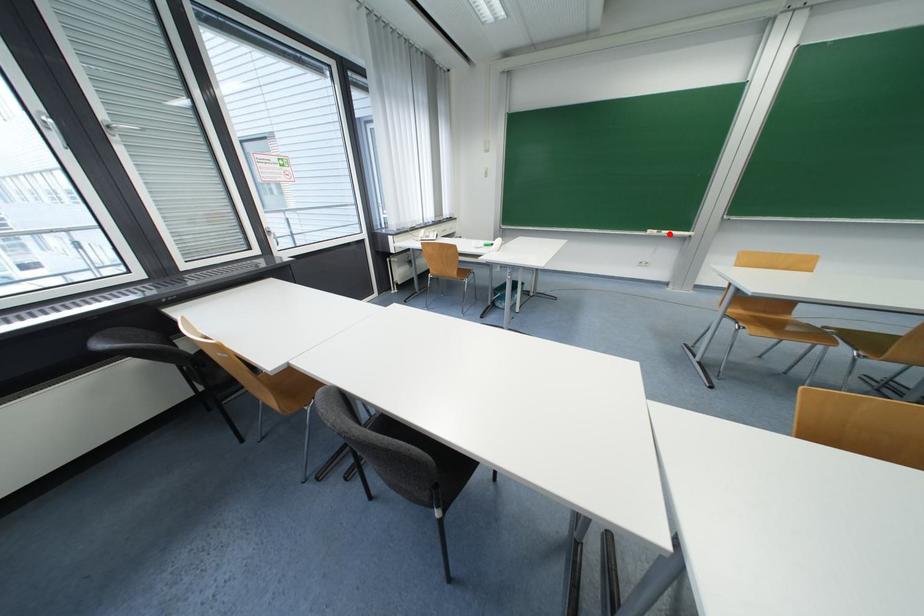
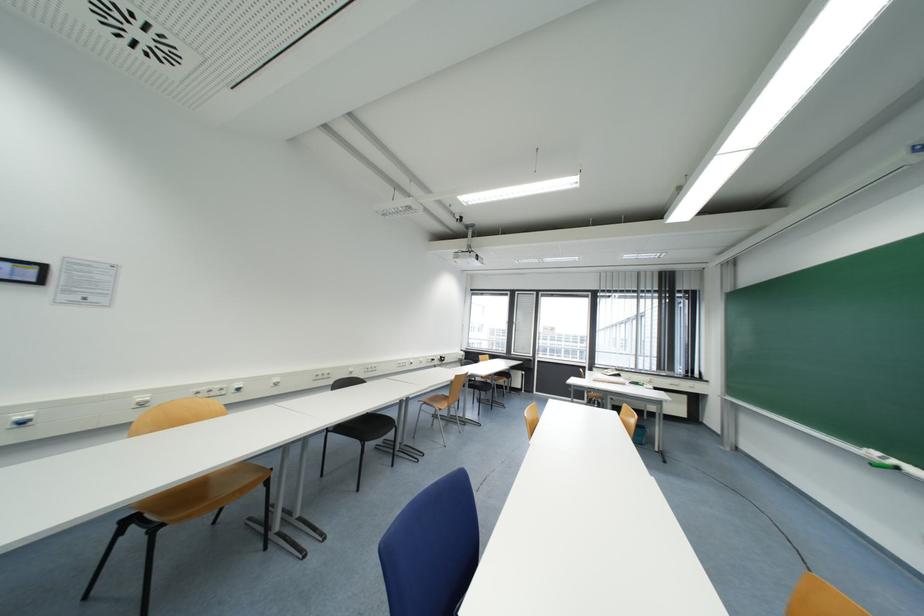
Where in the second image is the point corresponding to the highlighted location from the first image?

(898, 464)